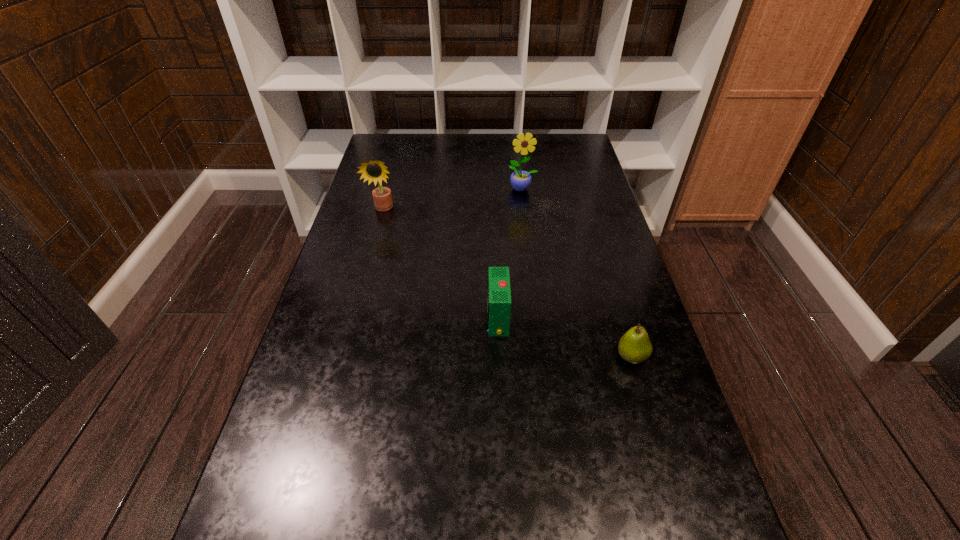
Identify the location of free space that is in between the second farthest object and the farthest object. This screenshot has height=540, width=960. (453, 199).

The height and width of the screenshot is (540, 960). I want to click on free space between the left sunflower and the third farthest object, so click(x=441, y=264).

Find the location of a particular element. The image size is (960, 540). blank region between the alarm clock and the rightmost object is located at coordinates (564, 338).

Find the location of a particular element. This screenshot has width=960, height=540. free space between the farther sunflower and the pear is located at coordinates (577, 273).

Where is `free space between the farther sunflower and the alarm clock`? The image size is (960, 540). free space between the farther sunflower and the alarm clock is located at coordinates (510, 254).

Find the location of `vacant space that is in between the farthest object and the alarm clock`. vacant space that is in between the farthest object and the alarm clock is located at coordinates (510, 254).

Identify the location of unoccupied position between the farthest object and the alarm clock. (510, 254).

I want to click on free space between the right sunflower and the second nearest object, so click(x=510, y=254).

Select which object is the closest to the leftmost object. Please provide its 2D coordinates. Your answer should be formatted as a tuple, i.e. [(x, y)], where the tuple contains the x and y coordinates of a point satisfying the conditions above.

[(520, 180)]

Select which object appears as the third closest to the third object from right to left. Please provide its 2D coordinates. Your answer should be formatted as a tuple, i.e. [(x, y)], where the tuple contains the x and y coordinates of a point satisfying the conditions above.

[(520, 180)]